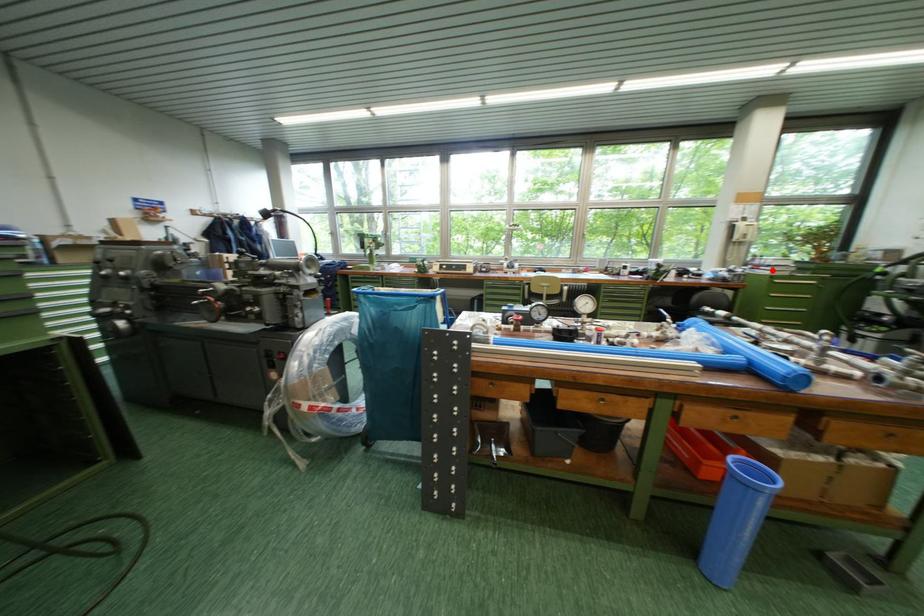
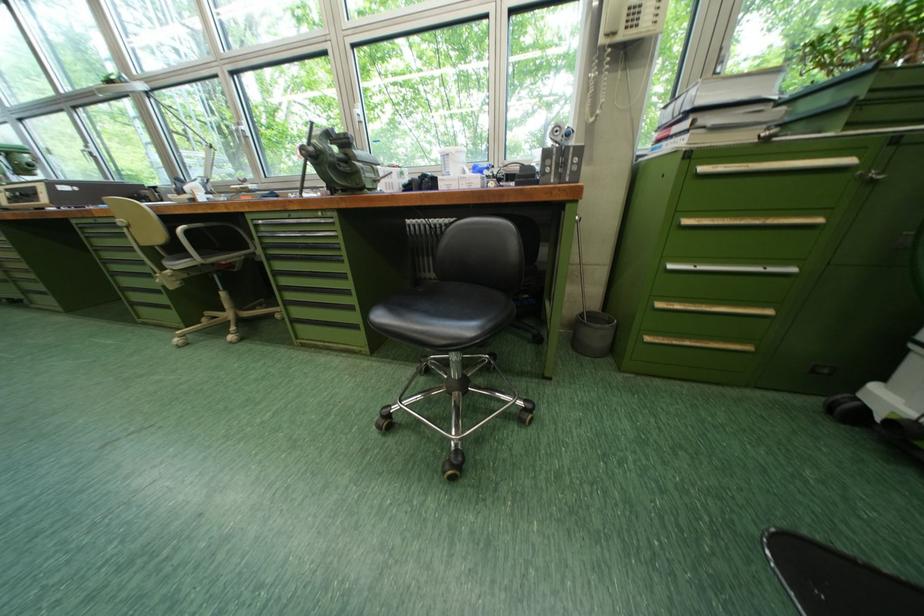
In the second image, find the point that corresponds to the highlighted location in the first image.

(686, 132)